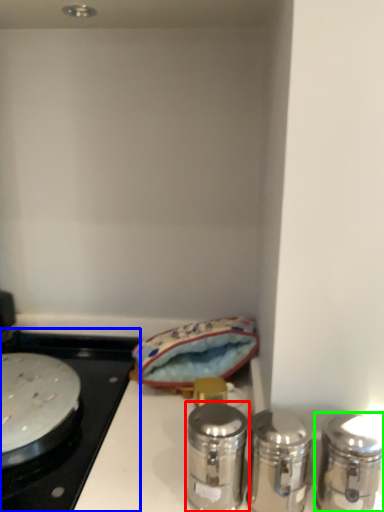
Question: Which object is positioned farthest from salt and pepper shakers (highlighted by a red box)? Select from gas stove (highlighted by a blue box) and salt and pepper shakers (highlighted by a green box).

Choices:
 (A) gas stove
 (B) salt and pepper shakers

Answer: (A)